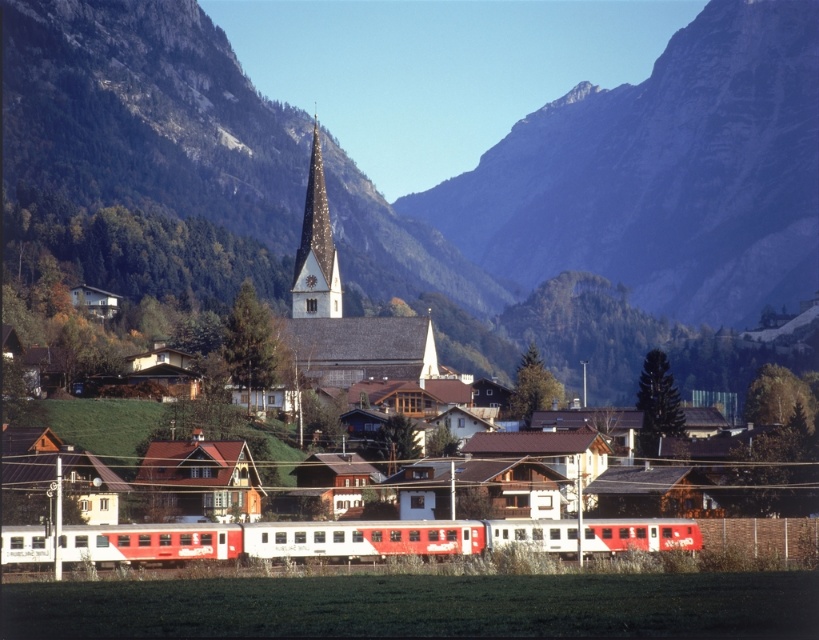
Based on the photo, is matte gray steeple at center positioned at the back of gold textured spire at center?

No, it is in front of gold textured spire at center.

Identify the location of matte gray steeple at center. This screenshot has width=819, height=640. (342, 310).

This screenshot has width=819, height=640. In order to click on matte gray steeple at center in this screenshot , I will do `click(342, 310)`.

Is rugged stone mountain at center to the right of gold textured spire at center from the viewer's perspective?

Indeed, rugged stone mountain at center is positioned on the right side of gold textured spire at center.

Does rugged stone mountain at center have a greater width compared to gold textured spire at center?

Correct, the width of rugged stone mountain at center exceeds that of gold textured spire at center.

Is point (735, 129) farther from viewer compared to point (311, 205)?

Yes.

Where is `rugged stone mountain at center`? rugged stone mountain at center is located at coordinates (663, 173).

Does white glossy passenger train at center lie in front of matte gray steeple at center?

Yes, it is.

Is point (181, 556) more distant than point (320, 196)?

No.

The height and width of the screenshot is (640, 819). Identify the location of white glossy passenger train at center. (310, 540).